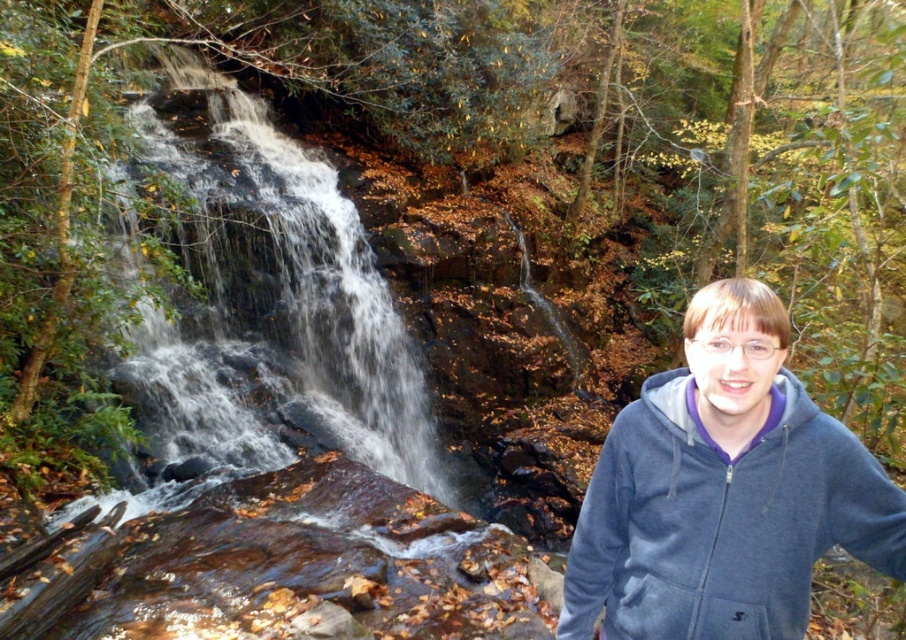
Does white frothy water at left lie in front of dark blue fleece sweatshirt at right?

Answer: No, white frothy water at left is behind dark blue fleece sweatshirt at right.

Does white frothy water at left appear over dark blue fleece sweatshirt at right?

No, white frothy water at left is not above dark blue fleece sweatshirt at right.

Between point (267, 465) and point (588, 625), which one is positioned behind?

The point (267, 465) is behind.

Find the location of a particular element. white frothy water at left is located at coordinates (275, 307).